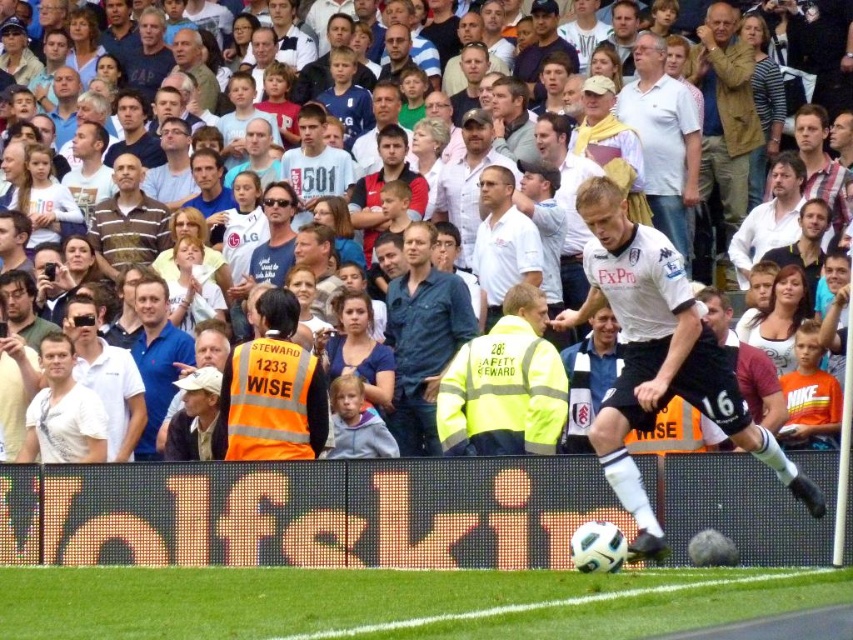
Question: Can you confirm if brown textured jacket at upper right is positioned below striped cotton shirt at center?

Choices:
 (A) no
 (B) yes

Answer: (A)

Question: Which point is farther to the camera?

Choices:
 (A) white shirt at center
 (B) brown textured jacket at upper right
 (C) striped cotton shirt at center
 (D) white cotton shirt at upper center

Answer: (C)

Question: Considering the real-world distances, which object is farthest from the white cotton shirt at upper center?

Choices:
 (A) blue cotton shirt at center
 (B) white jersey at center

Answer: (A)

Question: Is blue cotton shirt at center further to camera compared to brown textured jacket at upper right?

Choices:
 (A) yes
 (B) no

Answer: (B)

Question: Which point is closer to the camera taking this photo?

Choices:
 (A) (726, 96)
 (B) (471, 449)
 (C) (511, 193)
 (D) (141, 236)

Answer: (B)

Question: Does white cotton shirt at upper center appear on the left side of white shirt at center?

Choices:
 (A) no
 (B) yes

Answer: (A)